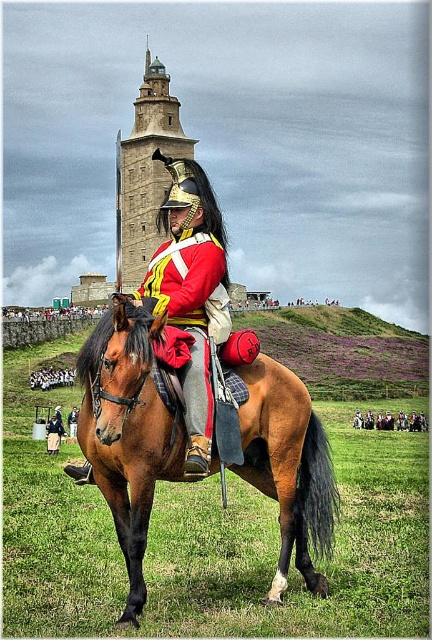
Who is positioned more to the left, red wool coat at center or shiny red coat at center?

shiny red coat at center is more to the left.

From the picture: Who is more distant from viewer, (x=165, y=244) or (x=29, y=380)?

Point (x=165, y=244)

I want to click on red wool coat at center, so click(x=189, y=307).

Find the location of a particular element. This screenshot has height=640, width=432. red wool coat at center is located at coordinates (189, 307).

Can you confirm if stone tower at upper center is taller than red woolen coat at center?

Yes.

From the picture: How distant is stone tower at upper center from red woolen coat at center?

54.85 meters

What do you see at coordinates (145, 172) in the screenshot? I see `stone tower at upper center` at bounding box center [145, 172].

Where is `stone tower at upper center`? stone tower at upper center is located at coordinates (145, 172).

Is point (170, 275) more distant than point (73, 376)?

No, it is in front of (73, 376).

Does shiny red uniform at center have a smaller size compared to shiny red coat at center?

No, shiny red uniform at center is not smaller than shiny red coat at center.

The height and width of the screenshot is (640, 432). What do you see at coordinates (190, 291) in the screenshot?
I see `shiny red uniform at center` at bounding box center [190, 291].

Locate an element on the screen. The height and width of the screenshot is (640, 432). shiny red uniform at center is located at coordinates (190, 291).